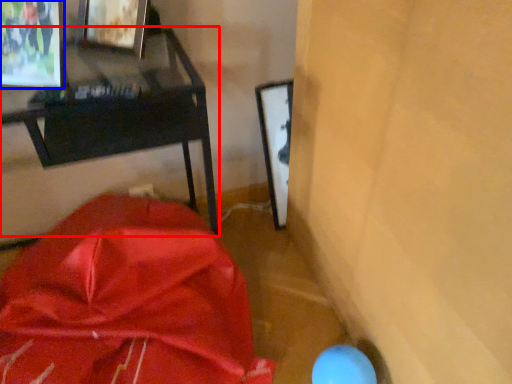
Question: Which object is closer to the camera taking this photo, furniture (highlighted by a red box) or picture frame (highlighted by a blue box)?

Choices:
 (A) furniture
 (B) picture frame

Answer: (A)